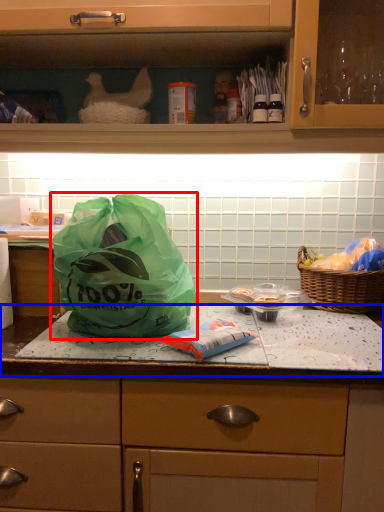
Question: Which object is closer to the camera taking this photo, plastic bag (highlighted by a red box) or counter top (highlighted by a blue box)?

Choices:
 (A) plastic bag
 (B) counter top

Answer: (A)